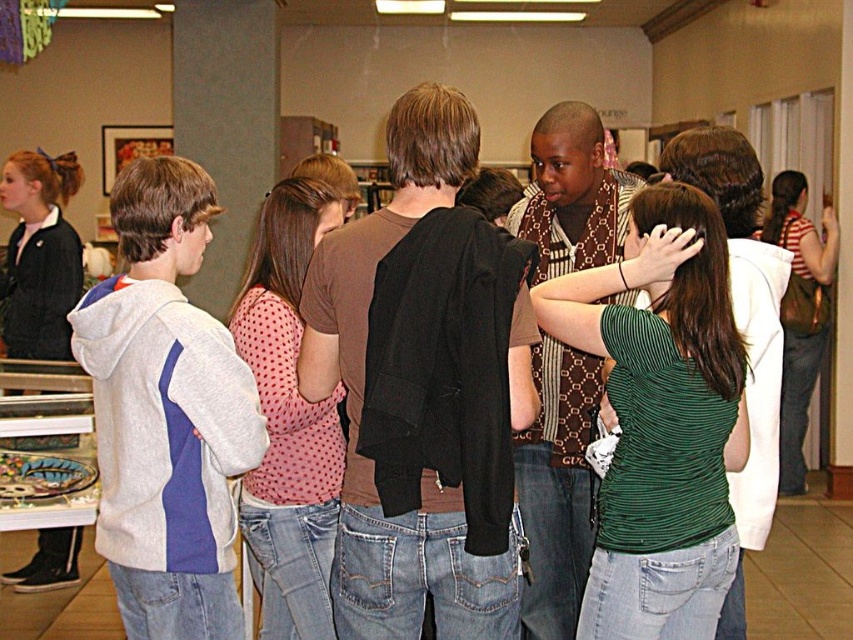
Question: Among these objects, which one is farthest from the camera?

Choices:
 (A) green ribbed shirt at center
 (B) gray hoodie at left

Answer: (A)

Question: Among these objects, which one is farthest from the camera?

Choices:
 (A) green ribbed shirt at center
 (B) gray hoodie at left

Answer: (A)

Question: In this image, where is gray hoodie at left located relative to green ribbed shirt at center?

Choices:
 (A) below
 (B) above

Answer: (B)

Question: Can you confirm if gray hoodie at left is bigger than green ribbed shirt at center?

Choices:
 (A) yes
 (B) no

Answer: (A)

Question: Is gray hoodie at left closer to the viewer compared to green ribbed shirt at center?

Choices:
 (A) no
 (B) yes

Answer: (B)

Question: Among these objects, which one is farthest from the camera?

Choices:
 (A) gray hoodie at left
 (B) green ribbed shirt at center

Answer: (B)